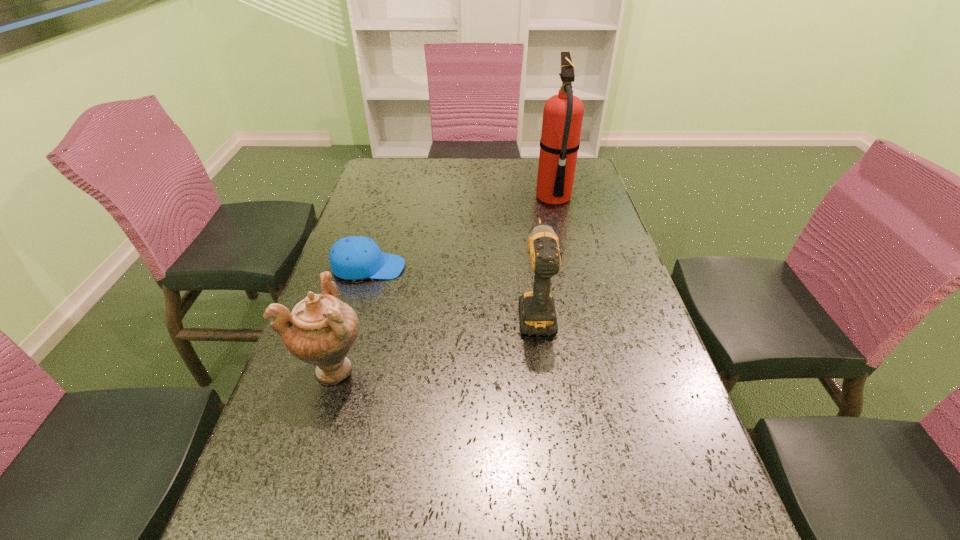
The image size is (960, 540). I want to click on free space at the left edge of the desktop, so click(x=376, y=288).

Where is `free space at the right edge of the desktop`? Image resolution: width=960 pixels, height=540 pixels. free space at the right edge of the desktop is located at coordinates (620, 424).

The height and width of the screenshot is (540, 960). Find the location of `vacant space at the far left corner of the desktop`. vacant space at the far left corner of the desktop is located at coordinates (392, 170).

Where is `free space between the shortest object and the rightmost object`? The image size is (960, 540). free space between the shortest object and the rightmost object is located at coordinates (461, 233).

At what (x,y) coordinates should I click in order to perform the action: click on vacant point located between the third nearest object and the drill. Please return your answer as a coordinate pair (x, y). Image resolution: width=960 pixels, height=540 pixels. Looking at the image, I should click on (452, 289).

Locate an element on the screen. vacant area that lies between the cap and the drill is located at coordinates (x=452, y=289).

Where is `vacant region between the shortest object and the drill`? Image resolution: width=960 pixels, height=540 pixels. vacant region between the shortest object and the drill is located at coordinates (452, 289).

Point out which object is positioned as the second nearest to the second object from right to left. Please provide its 2D coordinates. Your answer should be formatted as a tuple, i.e. [(x, y)], where the tuple contains the x and y coordinates of a point satisfying the conditions above.

[(321, 330)]

Where is `object that is the second closest to the third nearest object`? The image size is (960, 540). object that is the second closest to the third nearest object is located at coordinates (537, 312).

Identify the location of vacant position in the image that satisfies the following two spatial constraints: 1. with the drill bit of the third object from left to right facing forward; 2. on the front-facing side of the shortest object. The width and height of the screenshot is (960, 540). (530, 267).